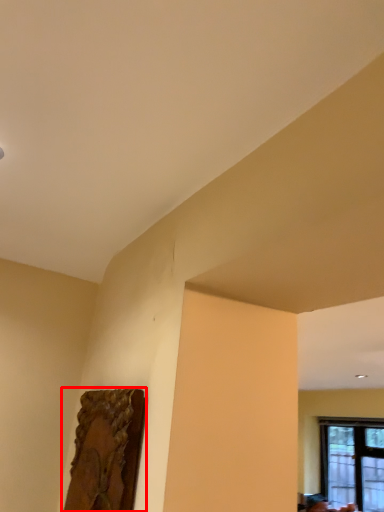
Question: From the image's perspective, where is picture frame (annotated by the red box) located relative to window?

Choices:
 (A) below
 (B) above

Answer: (B)